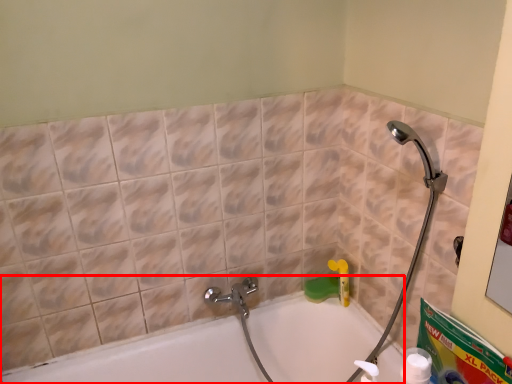
Question: From the image's perspective, where is bathtub (annotated by the red box) located relative to cleaning product?

Choices:
 (A) below
 (B) above

Answer: (A)